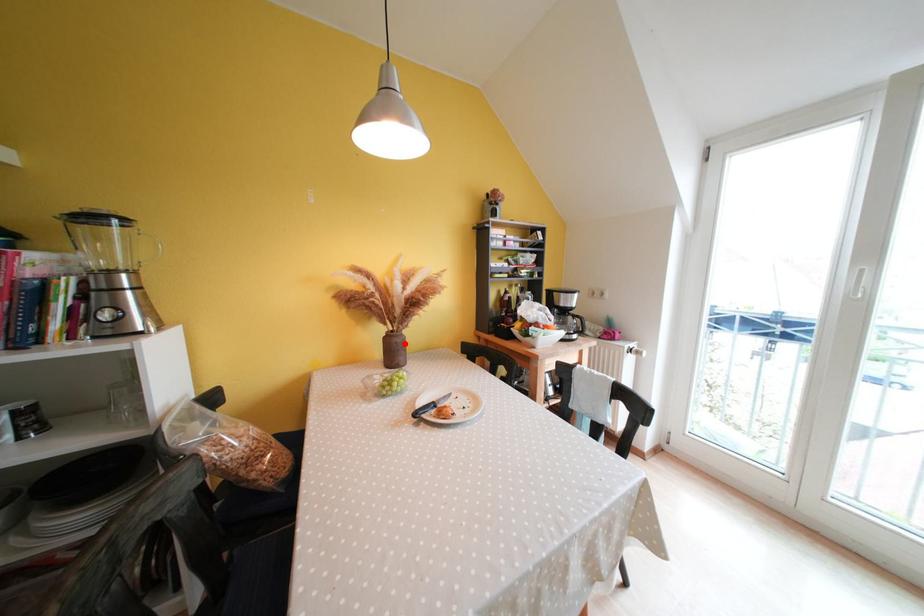
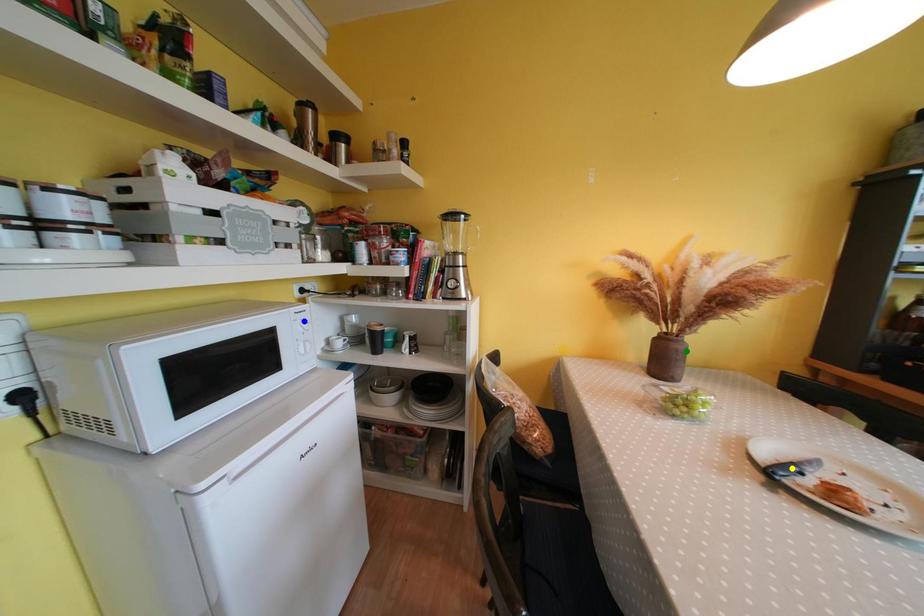
Question: I am providing you with two images of the same scene from different viewpoints. A red point is marked on the first image. You are given multiple points on the second image. In image 2, which mark is for the same physical point as the one in image 1?

Choices:
 (A) blue point
 (B) green point
 (C) yellow point

Answer: (B)